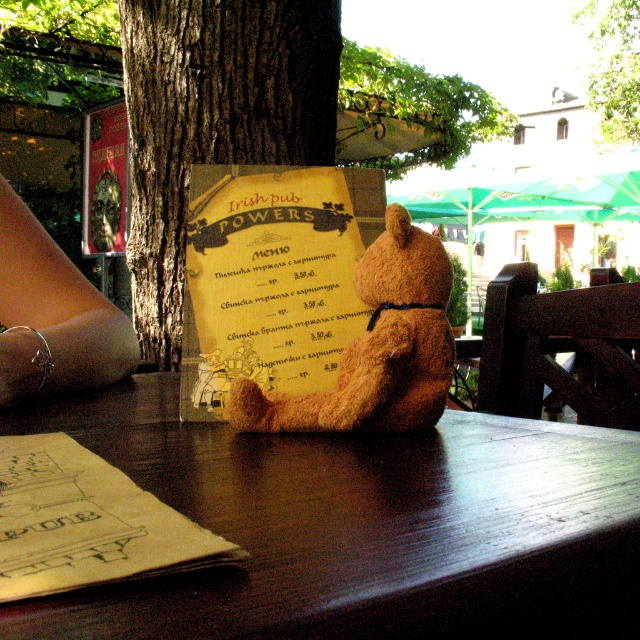
Question: Observing the image, what is the correct spatial positioning of brown rough bark tree at center in reference to green leafy tree at upper right?

Choices:
 (A) right
 (B) left

Answer: (B)

Question: Based on their relative distances, which object is farther from the green leafy tree at upper right?

Choices:
 (A) green leafy tree at upper center
 (B) brown rough bark tree at center
 (C) brown plush bear at center
 (D) brown wooden table at center

Answer: (C)

Question: Among these points, which one is nearest to the camera?

Choices:
 (A) (56, 630)
 (B) (102, 378)
 (C) (592, 77)

Answer: (A)

Question: Does brown rough bark tree at center appear on the right side of brown plush bear at center?

Choices:
 (A) yes
 (B) no

Answer: (B)

Question: Does brown wooden table at center have a smaller size compared to brown rough bark tree at center?

Choices:
 (A) no
 (B) yes

Answer: (B)

Question: Which object is farther from the camera taking this photo?

Choices:
 (A) brown rough bark tree at center
 (B) brown wooden table at center
 (C) green leafy tree at upper right
 (D) green leafy tree at upper center

Answer: (C)